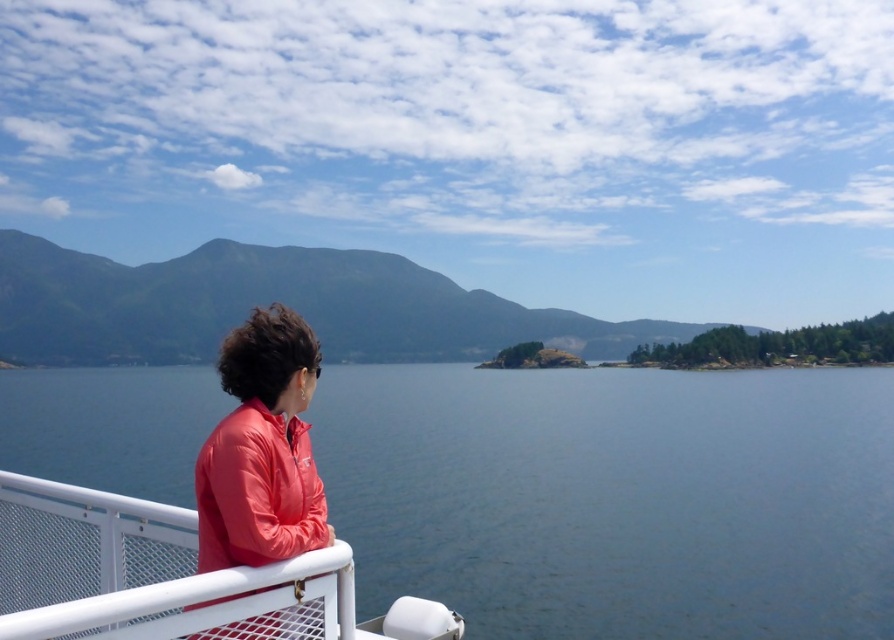
You are standing on the deck of a boat and see the blue water at center and the matte red jacket at left. Which object is closer to you?

The blue water at center is closer to you because the matte red jacket at left is behind it.

From the picture: You are standing on the deck of a ferry and see the green matte mountain at upper left and the matte red jacket at left. Which object is higher in the scene?

The green matte mountain at upper left is higher than the matte red jacket at left because it is positioned above it in the scene.